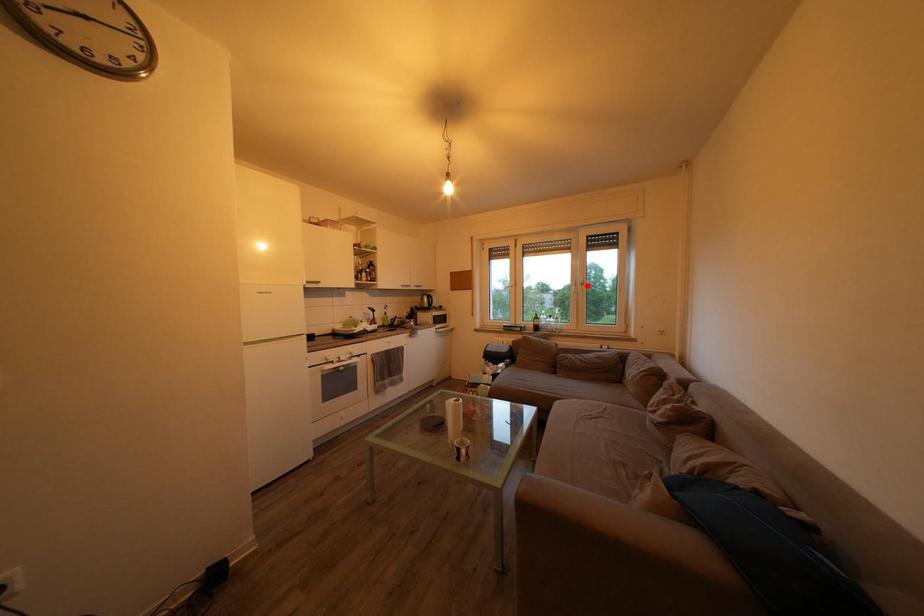
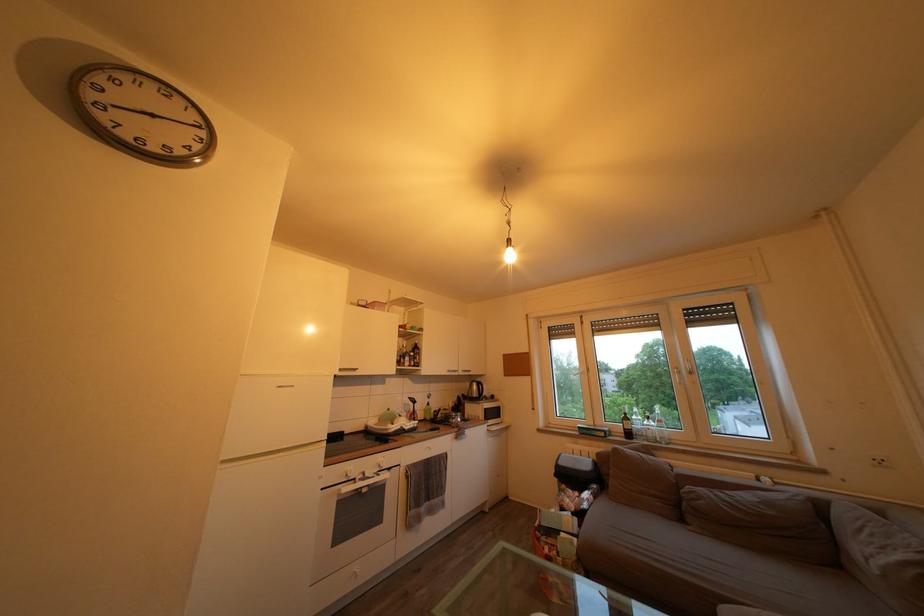
Where in the second image is the point corresponding to the highlighted location from the first image?

(691, 371)